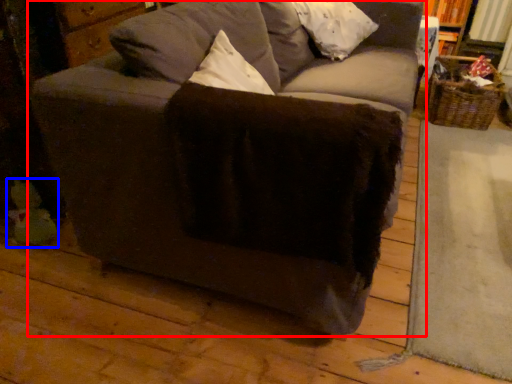
Question: Which object appears closest to the camera in this image, studio couch (highlighted by a red box) or toy (highlighted by a blue box)?

Choices:
 (A) studio couch
 (B) toy

Answer: (A)